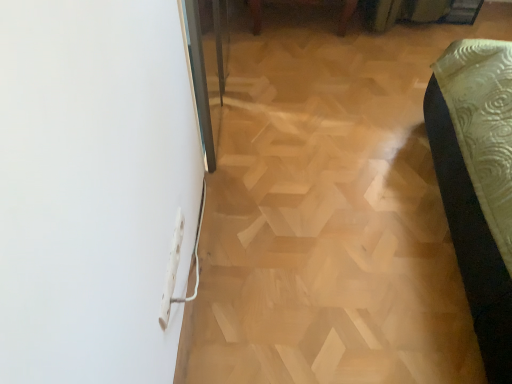
You are a GUI agent. You are given a task and a screenshot of the screen. Output one action in this format:
    pyautogui.click(x=<x>, y=<y>)
    Task: Click on the light wood parquet floor at center
    The width and height of the screenshot is (512, 384).
    Given the screenshot: What is the action you would take?
    pyautogui.click(x=331, y=212)

This screenshot has width=512, height=384. What do you see at coordinates (331, 212) in the screenshot?
I see `light wood parquet floor at center` at bounding box center [331, 212].

What is the approximate width of light wood parquet floor at center?

The width of light wood parquet floor at center is 1.81 meters.

What do you see at coordinates (172, 270) in the screenshot? I see `white plastic electric outlet at lower left` at bounding box center [172, 270].

In order to click on white plastic electric outlet at lower left in this screenshot , I will do `click(172, 270)`.

You are a GUI agent. You are given a task and a screenshot of the screen. Output one action in this format:
    pyautogui.click(x=<x>, y=<y>)
    Task: Click on the light wood parquet floor at center
    Image resolution: width=512 pixels, height=384 pixels.
    Given the screenshot: What is the action you would take?
    pyautogui.click(x=331, y=212)

Considering the relative positions of white plastic electric outlet at lower left and light wood parquet floor at center in the image provided, is white plastic electric outlet at lower left to the right of light wood parquet floor at center from the viewer's perspective?

No.

Between white plastic electric outlet at lower left and light wood parquet floor at center, which one is positioned in front?

white plastic electric outlet at lower left is closer to the camera.

Considering the positions of point (176, 261) and point (283, 261), is point (176, 261) closer or farther from the camera than point (283, 261)?

Clearly, point (176, 261) is closer to the camera than point (283, 261).

From the image's perspective, which is below, white plastic electric outlet at lower left or light wood parquet floor at center?

From the image's view, white plastic electric outlet at lower left is below.

From a real-world perspective, is white plastic electric outlet at lower left above or below light wood parquet floor at center?

Clearly, from a real-world perspective, white plastic electric outlet at lower left is above light wood parquet floor at center.

Considering the sizes of objects white plastic electric outlet at lower left and light wood parquet floor at center in the image provided, who is wider, white plastic electric outlet at lower left or light wood parquet floor at center?

light wood parquet floor at center is wider.

Does white plastic electric outlet at lower left have a greater height compared to light wood parquet floor at center?

Indeed, white plastic electric outlet at lower left has a greater height compared to light wood parquet floor at center.

Which of these two, white plastic electric outlet at lower left or light wood parquet floor at center, is bigger?

light wood parquet floor at center is bigger.

Would you say white plastic electric outlet at lower left contains light wood parquet floor at center?

No.

Is white plastic electric outlet at lower left positioned far away from light wood parquet floor at center?

No.

Is white plastic electric outlet at lower left turned away from light wood parquet floor at center?

No, white plastic electric outlet at lower left is not facing the opposite direction of light wood parquet floor at center.

The image size is (512, 384). I want to click on plywood above the white plastic electric outlet at lower left (from the image's perspective), so click(x=331, y=212).

Can you confirm if light wood parquet floor at center is positioned to the right of white plastic electric outlet at lower left?

Indeed, light wood parquet floor at center is positioned on the right side of white plastic electric outlet at lower left.

Is light wood parquet floor at center positioned in front of white plastic electric outlet at lower left?

That is False.

Is point (463, 339) closer to viewer compared to point (174, 300)?

No, it is not.

From the image's perspective, which one is positioned lower, light wood parquet floor at center or white plastic electric outlet at lower left?

white plastic electric outlet at lower left appears lower in the image.

From a real-world perspective, between light wood parquet floor at center and white plastic electric outlet at lower left, who is vertically higher?

white plastic electric outlet at lower left.

Based on the photo, between light wood parquet floor at center and white plastic electric outlet at lower left, which one has smaller width?

Thinner between the two is white plastic electric outlet at lower left.

Considering the sizes of objects light wood parquet floor at center and white plastic electric outlet at lower left in the image provided, who is taller, light wood parquet floor at center or white plastic electric outlet at lower left?

white plastic electric outlet at lower left.

Is light wood parquet floor at center bigger than white plastic electric outlet at lower left?

Yes.

Choose the correct answer: Is light wood parquet floor at center inside white plastic electric outlet at lower left or outside it?

light wood parquet floor at center exists outside the volume of white plastic electric outlet at lower left.

Are light wood parquet floor at center and white plastic electric outlet at lower left located far from each other?

light wood parquet floor at center is actually quite close to white plastic electric outlet at lower left.

Is light wood parquet floor at center looking in the opposite direction of white plastic electric outlet at lower left?

light wood parquet floor at center does not have its back to white plastic electric outlet at lower left.

Can you tell me how much light wood parquet floor at center and white plastic electric outlet at lower left differ in facing direction?

light wood parquet floor at center and white plastic electric outlet at lower left are facing 89.7 degrees away from each other.

At what (x,y) coordinates should I click in order to perform the action: click on electric outlet on the left of light wood parquet floor at center. Please return your answer as a coordinate pair (x, y). The width and height of the screenshot is (512, 384). Looking at the image, I should click on (172, 270).

At what (x,y) coordinates should I click in order to perform the action: click on electric outlet above the light wood parquet floor at center (from a real-world perspective). Please return your answer as a coordinate pair (x, y). Image resolution: width=512 pixels, height=384 pixels. Looking at the image, I should click on (172, 270).

Where is `plywood below the white plastic electric outlet at lower left (from a real-world perspective)`? The image size is (512, 384). plywood below the white plastic electric outlet at lower left (from a real-world perspective) is located at coordinates (331, 212).